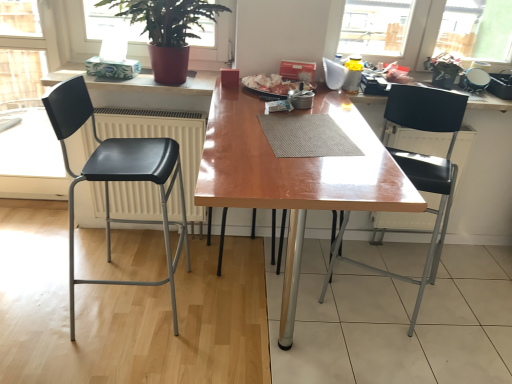
Question: Is black plastic chair at right, marked as the 1th chair in a right-to-left arrangement, aimed at matte plastic counter top at upper left?

Choices:
 (A) no
 (B) yes

Answer: (A)

Question: Is black plastic chair at right, which is the 2th chair in left-to-right order, facing away from matte plastic counter top at upper left?

Choices:
 (A) no
 (B) yes

Answer: (A)

Question: Would you consider black plastic chair at right, marked as the 1th chair in a right-to-left arrangement, to be distant from matte plastic counter top at upper left?

Choices:
 (A) yes
 (B) no

Answer: (A)

Question: From the image's perspective, would you say black plastic chair at right, marked as the 1th chair in a right-to-left arrangement, is positioned over matte plastic counter top at upper left?

Choices:
 (A) no
 (B) yes

Answer: (A)

Question: Does black plastic chair at right, which is the 2th chair in left-to-right order, lie behind matte plastic counter top at upper left?

Choices:
 (A) no
 (B) yes

Answer: (A)

Question: Is the position of black plastic chair at right, marked as the 1th chair in a right-to-left arrangement, less distant than that of matte plastic counter top at upper left?

Choices:
 (A) no
 (B) yes

Answer: (B)

Question: From a real-world perspective, is matte red pot at upper left positioned under black plastic chair at right, marked as the 1th chair in a right-to-left arrangement, based on gravity?

Choices:
 (A) yes
 (B) no

Answer: (B)

Question: Is matte red pot at upper left aimed at black plastic chair at right, which is the 2th chair in left-to-right order?

Choices:
 (A) yes
 (B) no

Answer: (B)

Question: Is matte red pot at upper left outside black plastic chair at right, marked as the 1th chair in a right-to-left arrangement?

Choices:
 (A) yes
 (B) no

Answer: (A)

Question: Is matte red pot at upper left taller than black plastic chair at right, marked as the 1th chair in a right-to-left arrangement?

Choices:
 (A) yes
 (B) no

Answer: (B)

Question: Is matte red pot at upper left not near black plastic chair at right, marked as the 1th chair in a right-to-left arrangement?

Choices:
 (A) yes
 (B) no

Answer: (A)

Question: Does matte red pot at upper left appear on the right side of black plastic chair at right, marked as the 1th chair in a right-to-left arrangement?

Choices:
 (A) no
 (B) yes

Answer: (A)

Question: Is wooden table at center thinner than black matte chair at left, marked as the 2th chair in a right-to-left arrangement?

Choices:
 (A) no
 (B) yes

Answer: (A)